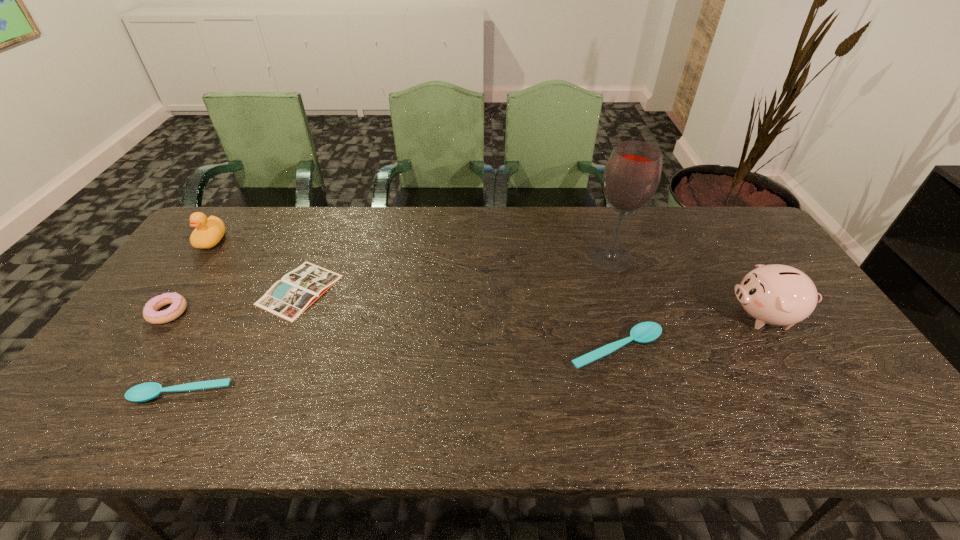
The image size is (960, 540). What are the coordinates of `free region located 0.320m on the back of the shorter spoon` in the screenshot? It's located at (241, 288).

What are the coordinates of `vacant region located on the left of the fifth tallest object` in the screenshot? It's located at (489, 349).

The height and width of the screenshot is (540, 960). In order to click on vacant space located on the face of the duck in this screenshot , I will do `click(136, 346)`.

I want to click on free space located 0.150m on the front of the piggy bank, so click(x=813, y=390).

Where is `blank area located 0.340m on the left of the alcohol`? This screenshot has height=540, width=960. blank area located 0.340m on the left of the alcohol is located at coordinates (478, 258).

Locate an element on the screen. The height and width of the screenshot is (540, 960). blank area located on the right of the book is located at coordinates (436, 290).

Where is `vacant area situated 0.270m on the right of the fourth shortest object`? This screenshot has width=960, height=540. vacant area situated 0.270m on the right of the fourth shortest object is located at coordinates (285, 312).

Find the location of a particular element. duck located at the far edge is located at coordinates (209, 231).

Locate an element on the screen. The width and height of the screenshot is (960, 540). alcohol present at the far edge is located at coordinates (632, 174).

Identify the location of spoon that is at the left edge. The width and height of the screenshot is (960, 540). (143, 392).